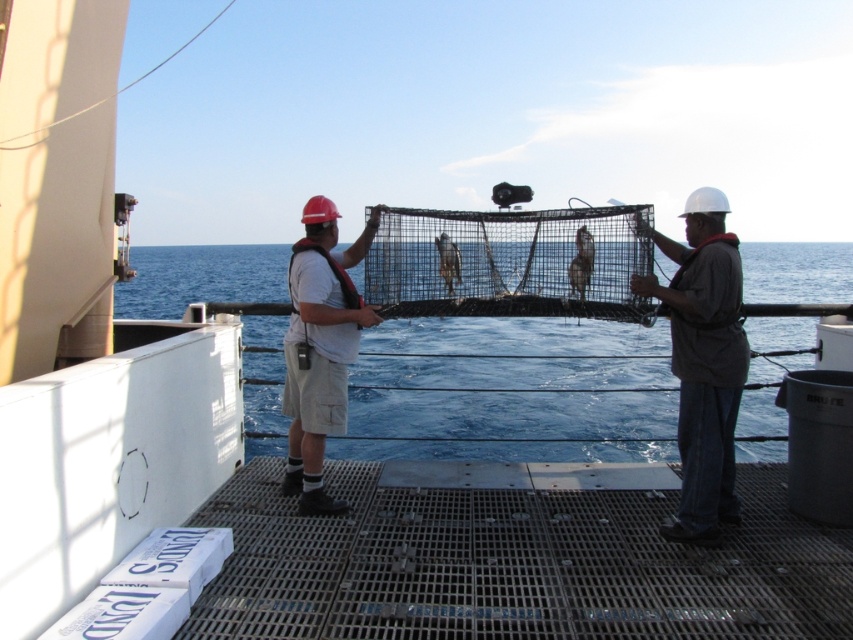
Consider the image. You are standing on the deck of a ship and need to retrieve a tool located at point (683, 419). The safety protocols require that you stay within 4 meters of the deck edge to avoid falling overboard. Can you safely reach the tool without violating the safety rule?

The distance of point (683, 419) from the viewer is 4.50 meters. Since the safety protocol requires staying within 4 meters of the deck edge, reaching the tool would exceed the allowed distance, making it unsafe to retrieve it without violating the safety rule.

You are a safety inspector on the ship deck. You need to ensure that the brown matte fish at center is visible to the crew member in the dark gray fabric shirt at right. Is the fish currently visible to them based on their positions?

The dark gray fabric shirt at right is in front of the brown matte fish at center, so the fish is currently blocked from view by the shirt and not visible to the crew member in the dark gray fabric shirt at right.